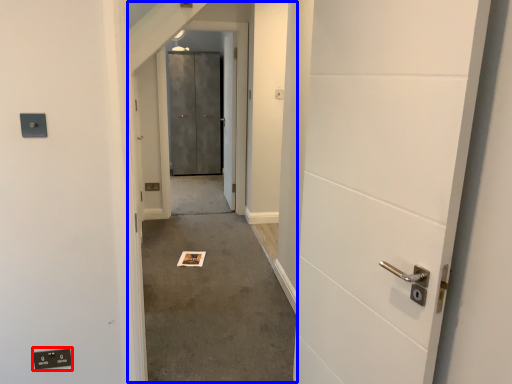
Question: Which object is closer to the camera taking this photo, electric outlet (highlighted by a red box) or corridor (highlighted by a blue box)?

Choices:
 (A) electric outlet
 (B) corridor

Answer: (B)